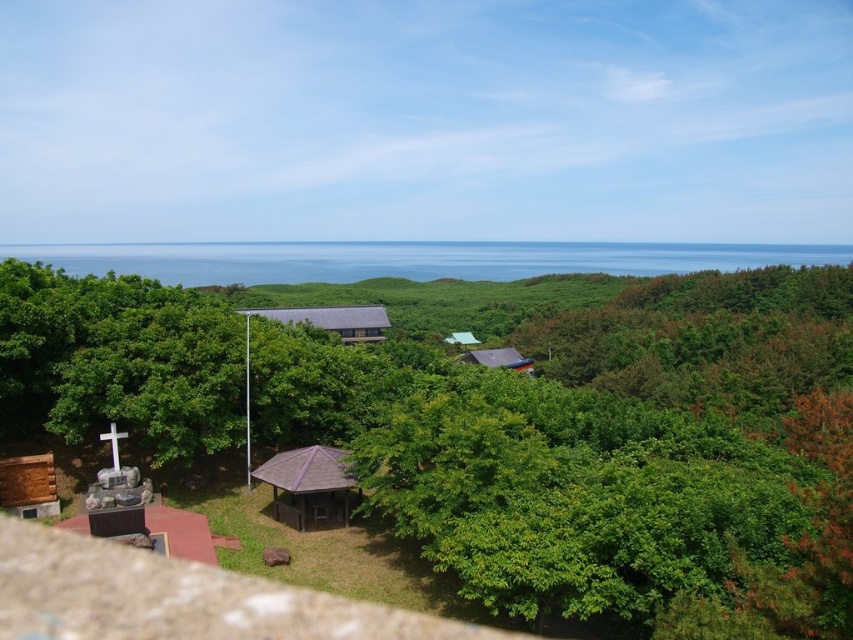
You are standing at the stone cross mounted on a pedestal on the left side of the image. You want to walk towards the small structure with a dark, sloped roof nestled among the trees in the foreground. Which point, point (375, 321) or point (486, 349), is closer to your starting position?

Point (375, 321) is closer to your starting position at the stone cross mounted on a pedestal on the left side of the image because it is in front of point (486, 349).